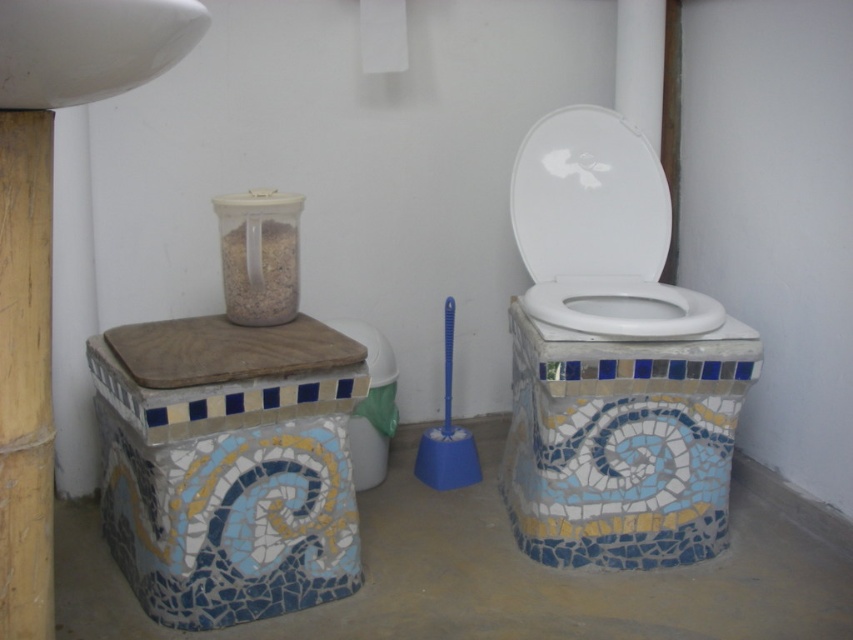
Question: Is white glossy toilet lid at center closer to the viewer compared to white glossy toilet bowl at center?

Choices:
 (A) yes
 (B) no

Answer: (B)

Question: Which object appears farthest from the camera in this image?

Choices:
 (A) white glossy toilet lid at center
 (B) white glossy sink at upper left

Answer: (A)

Question: Estimate the real-world distances between objects in this image. Which object is farther from the white glossy toilet lid at center?

Choices:
 (A) white glossy sink at upper left
 (B) white glossy toilet bowl at center

Answer: (A)

Question: Considering the relative positions of white glossy toilet lid at center and mosaic tile toilet bowl at center in the image provided, where is white glossy toilet lid at center located with respect to mosaic tile toilet bowl at center?

Choices:
 (A) right
 (B) left

Answer: (A)

Question: Does wooden pole at left come behind white glossy sink at upper left?

Choices:
 (A) no
 (B) yes

Answer: (B)

Question: Which object is the closest to the white glossy toilet lid at center?

Choices:
 (A) white glossy sink at upper left
 (B) white glossy toilet bowl at center

Answer: (B)